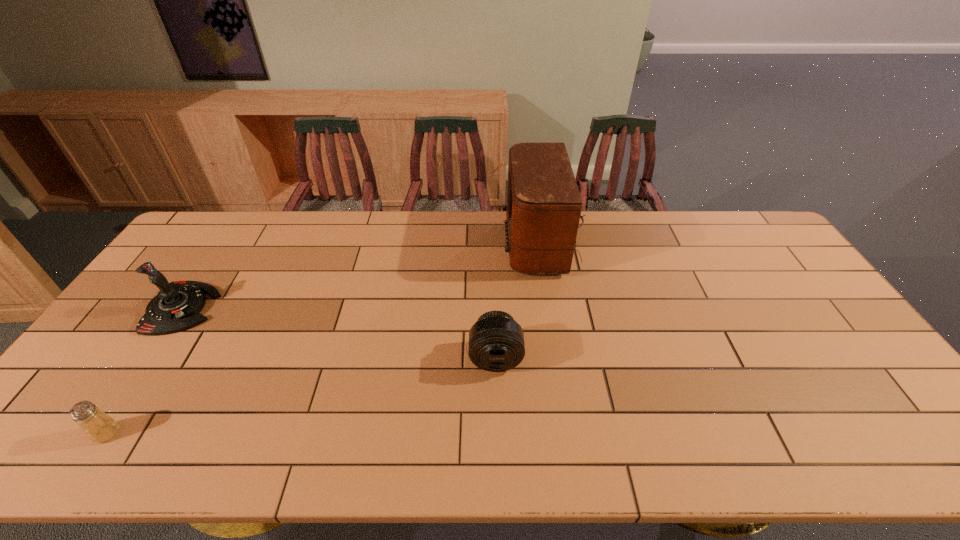
What are the coordinates of `free space that satisfies the following two spatial constraints: 1. on the front panel of the tallest object; 2. on the front-facing side of the third tallest object` in the screenshot? It's located at (570, 357).

At what (x,y) coordinates should I click in order to perform the action: click on free region that satisfies the following two spatial constraints: 1. on the handle side of the joystick; 2. on the left side of the saltshaker. Please return your answer as a coordinate pair (x, y). Looking at the image, I should click on (99, 433).

You are a GUI agent. You are given a task and a screenshot of the screen. Output one action in this format:
    pyautogui.click(x=<x>, y=<y>)
    Task: Click on the vacant area that satisfies the following two spatial constraints: 1. on the handle side of the joystick; 2. on the back side of the saltshaker
    This screenshot has height=540, width=960.
    Given the screenshot: What is the action you would take?
    pyautogui.click(x=99, y=433)

This screenshot has width=960, height=540. Find the location of `free region that satisfies the following two spatial constraints: 1. on the handle side of the shortest object; 2. on the left side of the third shortest object`. free region that satisfies the following two spatial constraints: 1. on the handle side of the shortest object; 2. on the left side of the third shortest object is located at coordinates (99, 433).

Where is `free space that satisfies the following two spatial constraints: 1. on the handle side of the nearest object; 2. on the right side of the third nearest object`? free space that satisfies the following two spatial constraints: 1. on the handle side of the nearest object; 2. on the right side of the third nearest object is located at coordinates (99, 433).

Where is `free space that satisfies the following two spatial constraints: 1. on the front panel of the radio receiver; 2. on the front-facing side of the second nearest object`? The width and height of the screenshot is (960, 540). free space that satisfies the following two spatial constraints: 1. on the front panel of the radio receiver; 2. on the front-facing side of the second nearest object is located at coordinates (570, 357).